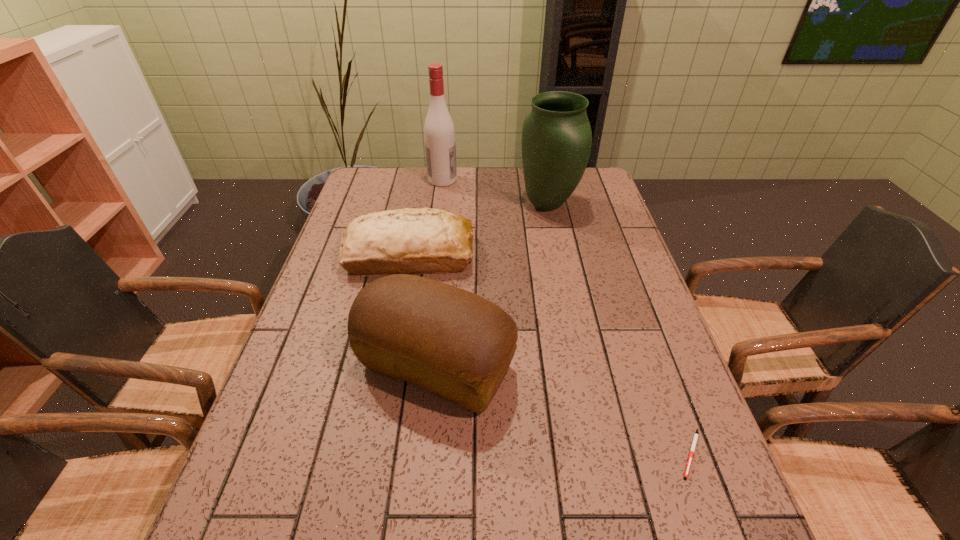
This screenshot has height=540, width=960. What are the coordinates of `alcohol` in the screenshot? It's located at (439, 132).

You are a GUI agent. You are given a task and a screenshot of the screen. Output one action in this format:
    pyautogui.click(x=<x>, y=<y>)
    Task: Click on the vase
    This screenshot has height=540, width=960.
    Given the screenshot: What is the action you would take?
    pyautogui.click(x=556, y=142)

In order to click on the second nearest object in this screenshot , I will do `click(454, 343)`.

I want to click on the taller bread, so click(454, 343).

The height and width of the screenshot is (540, 960). Find the location of `the third farthest object`. the third farthest object is located at coordinates tap(405, 241).

The width and height of the screenshot is (960, 540). I want to click on the shorter bread, so click(405, 241).

Where is `the nearest object`? The height and width of the screenshot is (540, 960). the nearest object is located at coordinates (695, 438).

The width and height of the screenshot is (960, 540). Identify the location of the rightmost object. (695, 438).

What are the coordinates of `vacant area situated 0.200m on the label of the alcohol` in the screenshot? It's located at (511, 180).

In order to click on free location located on the front of the vase in this screenshot , I will do `click(556, 241)`.